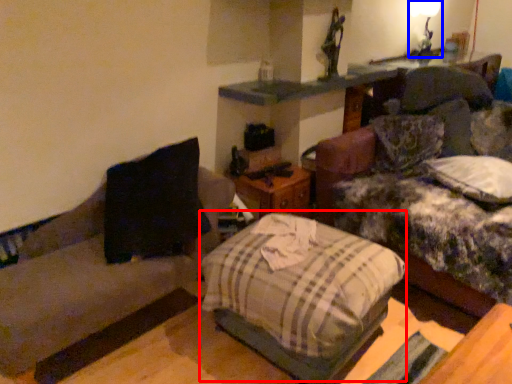
Question: Among these objects, which one is nearest to the camera, bed (highlighted by a red box) or light fixture (highlighted by a blue box)?

Choices:
 (A) bed
 (B) light fixture

Answer: (A)